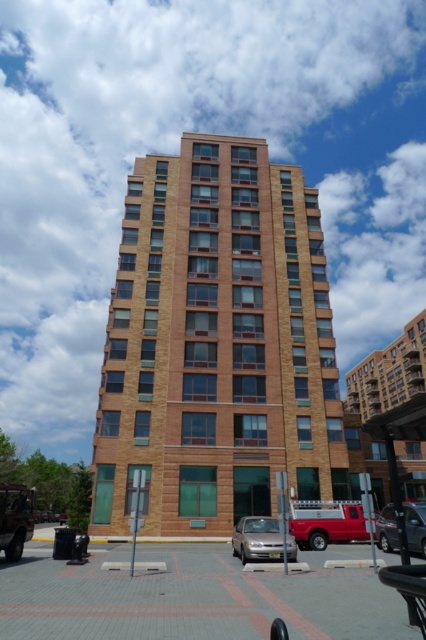
Looking at this image, you are standing in front of a brown brick building at center. You want to estimate how far you are from the building. Can you determine the distance using the information provided?

The distance between you and the brown brick building at center is 12.11 meters.

You are standing in front of a tall residential building with a modern design. You see a point at coordinates (256,540). Based on the scene description, can you determine what object this point is located on?

The point at coordinates (256,540) is located on the silver metallic sedan at center.